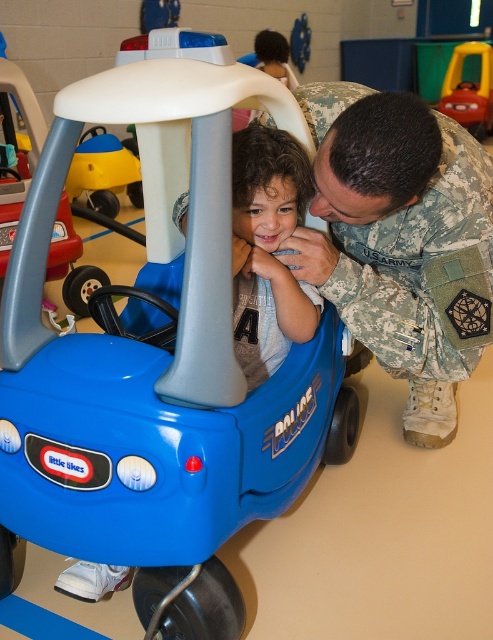
Question: Which of the following is the farthest from the observer?

Choices:
 (A) rubberized plastic car at upper right
 (B) matte blue car at center
 (C) blue plastic toy car at center

Answer: (A)

Question: Which point is farther to the camera?

Choices:
 (A) (240, 307)
 (B) (488, 106)

Answer: (B)

Question: Observing the image, what is the correct spatial positioning of camouflage uniform at center in reference to rubberized plastic car at upper right?

Choices:
 (A) above
 (B) below

Answer: (B)

Question: Can you confirm if camouflage uniform at center is thinner than matte yellow toy car at left?

Choices:
 (A) yes
 (B) no

Answer: (B)

Question: Which object is farther from the camera taking this photo?

Choices:
 (A) matte yellow toy car at left
 (B) camouflage uniform at center

Answer: (A)

Question: Does blue plastic toy car at center appear on the right side of matte yellow toy car at left?

Choices:
 (A) yes
 (B) no

Answer: (A)